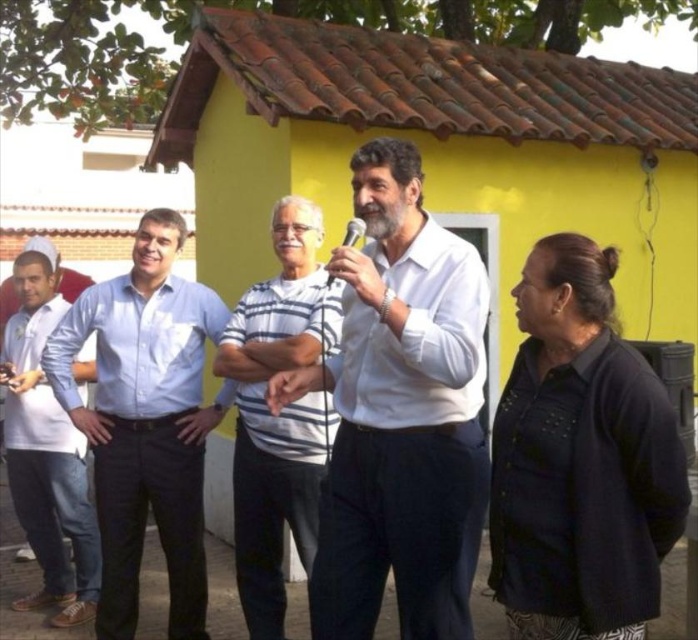
Question: Which object is farther from the camera taking this photo?

Choices:
 (A) black plastic microphone at center
 (B) white shirt at left

Answer: (B)

Question: Is gray striped shirt at center above white shirt at left?

Choices:
 (A) yes
 (B) no

Answer: (A)

Question: Can you confirm if white matte shirt at center is positioned to the left of light blue shirt at center?

Choices:
 (A) yes
 (B) no

Answer: (B)

Question: Does light blue shirt at center have a larger size compared to black plastic microphone at center?

Choices:
 (A) no
 (B) yes

Answer: (B)

Question: Among these points, which one is nearest to the camera?

Choices:
 (A) (34, 428)
 (B) (440, 280)
 (C) (349, 227)
 (D) (304, 397)

Answer: (B)

Question: Which of these objects is positioned farthest from the white shirt at left?

Choices:
 (A) light blue shirt at center
 (B) black plastic microphone at center
 (C) gray striped shirt at center

Answer: (B)